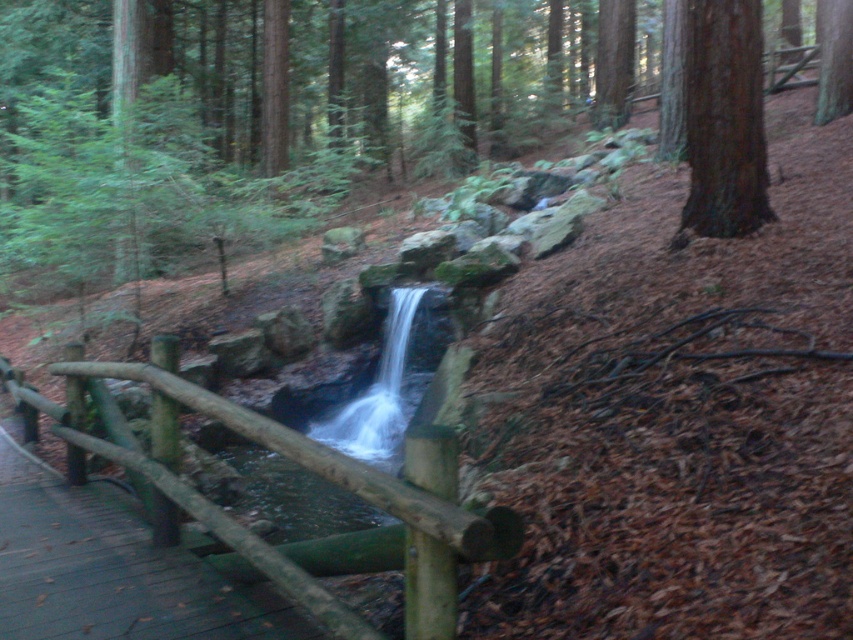
Question: Is brown rough bark tree at upper right below green rough bark tree at upper right?

Choices:
 (A) no
 (B) yes

Answer: (B)

Question: Which is nearer to the wooden fence at center?

Choices:
 (A) green rough bark tree at upper right
 (B) green mossy rock at center

Answer: (A)

Question: Which point is farther from the camera taking this photo?

Choices:
 (A) (16, 522)
 (B) (843, 49)
 (C) (749, 180)
 (D) (248, 429)

Answer: (B)

Question: Which of the following is the farthest from the observer?

Choices:
 (A) (703, 76)
 (B) (369, 499)

Answer: (A)

Question: Can you confirm if green mossy rock at center is positioned above brown rough bark tree at upper right?

Choices:
 (A) no
 (B) yes

Answer: (B)

Question: Observing the image, what is the correct spatial positioning of wooden walkway at lower left in reference to brown rough bark tree at upper right?

Choices:
 (A) below
 (B) above

Answer: (A)